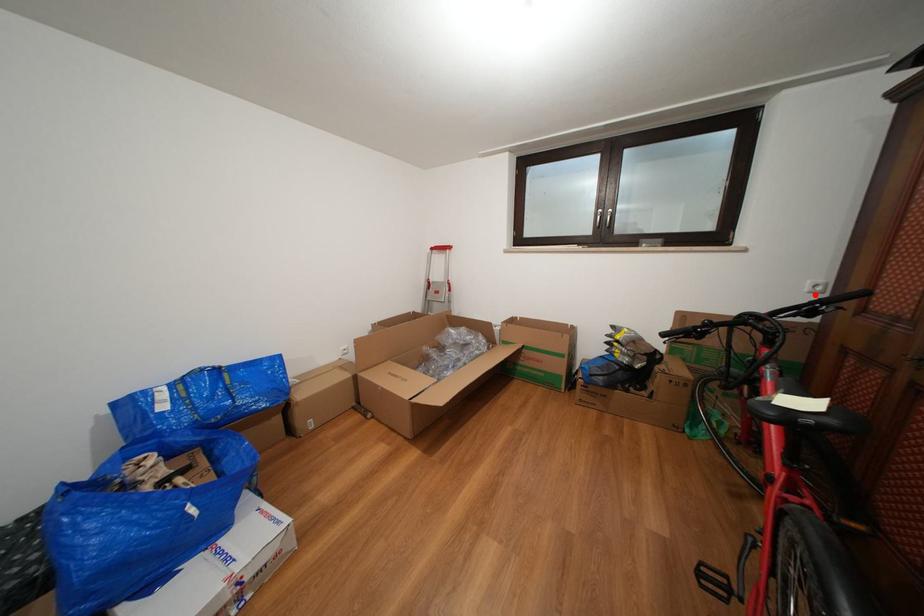
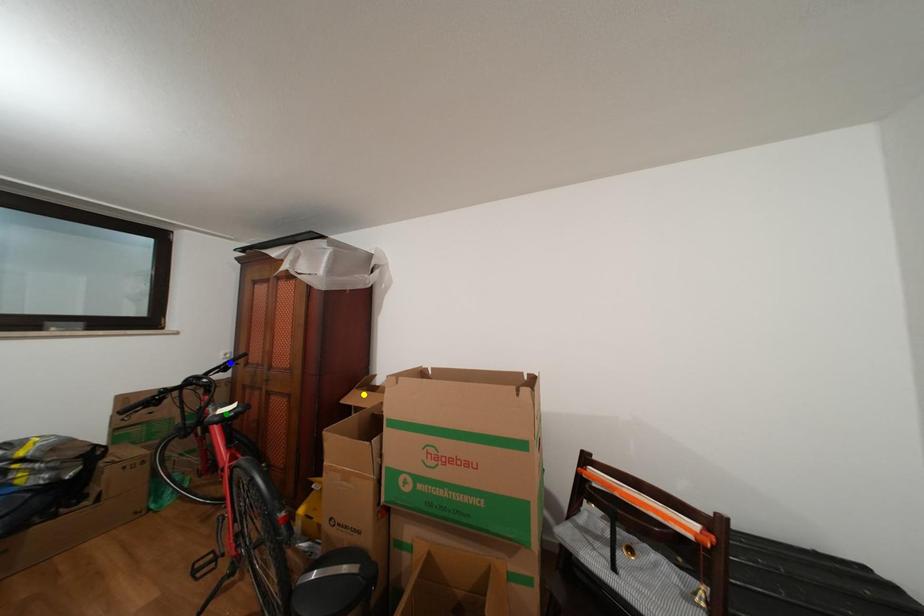
Question: I am providing you with two images of the same scene from different viewpoints. A red point is marked on the first image. You are given multiple points on the second image. Can you choose the point in image 2 that corresponds to the point in image 1?

Choices:
 (A) yellow point
 (B) blue point
 (C) green point

Answer: (B)